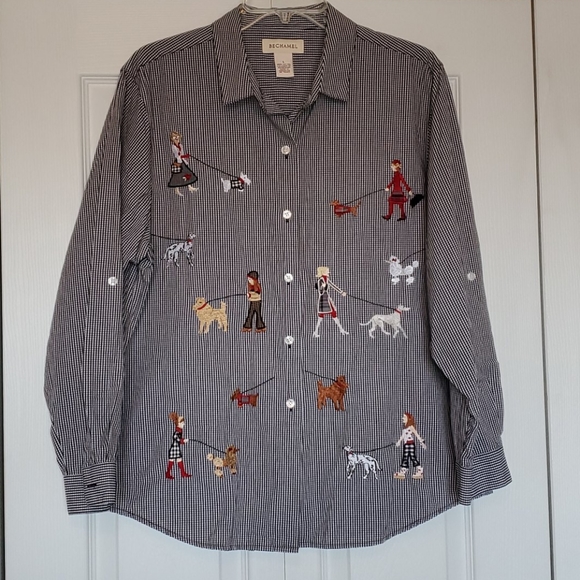
Where is `artwork low left`? artwork low left is located at coordinates (245, 395).